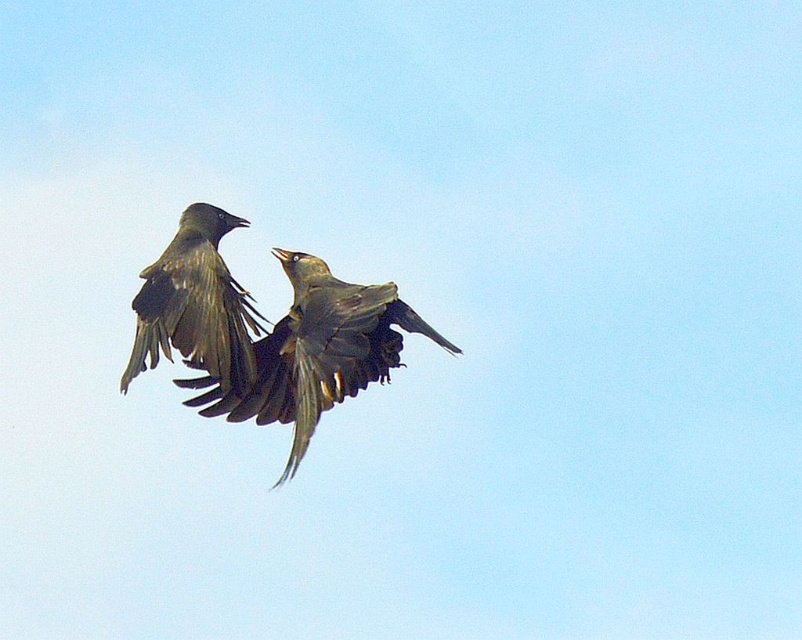
Question: Which point is farther to the camera?

Choices:
 (A) dark gray feathers at upper left
 (B) dark gray feathers at center

Answer: (A)

Question: Can you confirm if dark gray feathers at center is positioned to the right of dark gray feathers at upper left?

Choices:
 (A) no
 (B) yes

Answer: (B)

Question: Which point is closer to the camera taking this photo?

Choices:
 (A) (383, 348)
 (B) (180, 308)

Answer: (A)

Question: Considering the relative positions of dark gray feathers at center and dark gray feathers at upper left in the image provided, where is dark gray feathers at center located with respect to dark gray feathers at upper left?

Choices:
 (A) right
 (B) left

Answer: (A)

Question: Is dark gray feathers at center smaller than dark gray feathers at upper left?

Choices:
 (A) no
 (B) yes

Answer: (A)